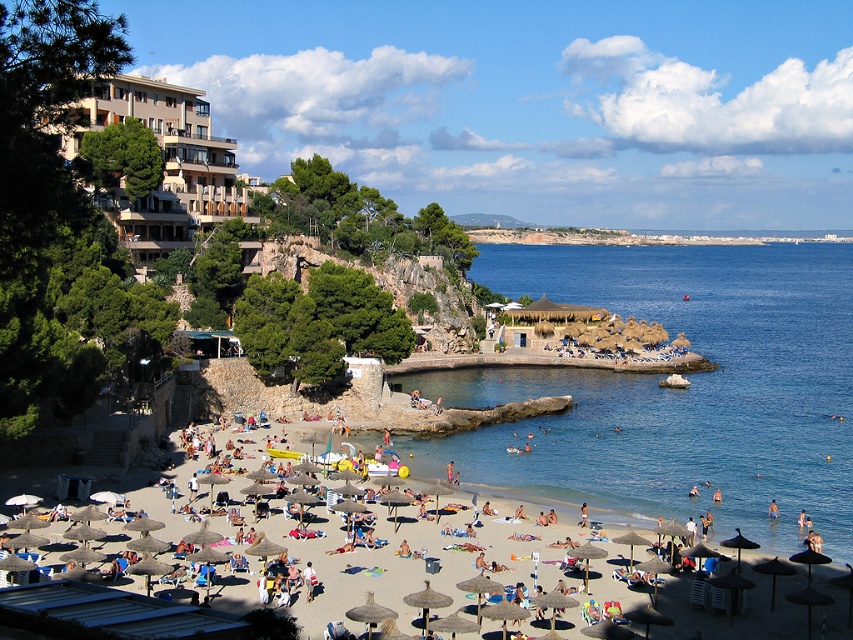
Is point (476, 260) farther from camera compared to point (165, 148)?

Yes, it is behind point (165, 148).

Is blue water at beach center shorter than beige concrete building at upper left?

No.

I want to click on blue water at beach center, so click(677, 390).

In the scene shown: Does beige concrete building at upper left have a greater width compared to beige sand beach at lower center?

Incorrect, beige concrete building at upper left's width does not surpass beige sand beach at lower center's.

Which is in front, point (189, 138) or point (345, 579)?

Point (345, 579) is in front.

Where is `beige concrete building at upper left`? Image resolution: width=853 pixels, height=640 pixels. beige concrete building at upper left is located at coordinates (163, 164).

Is blue water at beach center taller than beige sand beach at lower center?

Yes.

Is blue water at beach center bigger than beige sand beach at lower center?

Indeed, blue water at beach center has a larger size compared to beige sand beach at lower center.

The height and width of the screenshot is (640, 853). What are the coordinates of `blue water at beach center` in the screenshot? It's located at (677, 390).